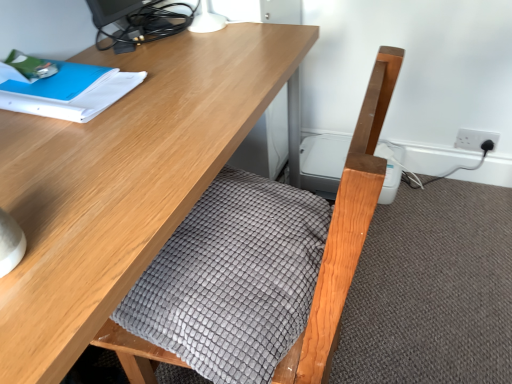
The height and width of the screenshot is (384, 512). What are the coordinates of `vacant area that is in front of blue paper at upper left` in the screenshot? It's located at (71, 154).